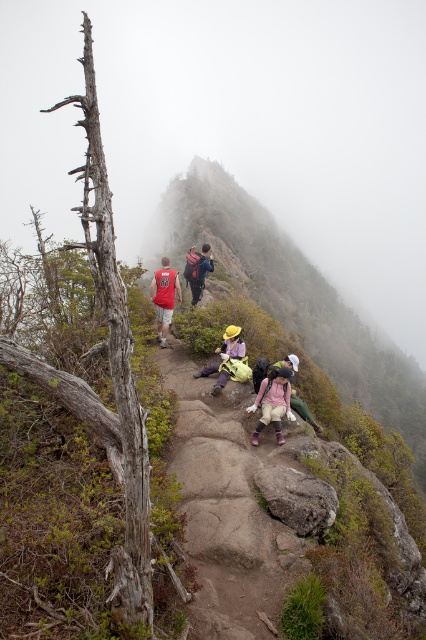
Question: Which object is closer to the camera taking this photo?

Choices:
 (A) yellow fabric hat at center
 (B) matte red backpack at center
 (C) rough stone trail at center
 (D) khaki pants at center

Answer: (C)

Question: Among these objects, which one is nearest to the camera?

Choices:
 (A) matte red backpack at center
 (B) matte red t-shirt at center
 (C) khaki pants at center

Answer: (C)

Question: Which of these objects is positioned closest to the rough stone trail at center?

Choices:
 (A) khaki pants at center
 (B) matte red backpack at center
 (C) matte red t-shirt at center
 (D) yellow fabric hat at center

Answer: (A)

Question: Is rough stone trail at center bigger than matte red t-shirt at center?

Choices:
 (A) no
 (B) yes

Answer: (A)

Question: Can you confirm if rough stone trail at center is positioned below khaki pants at center?

Choices:
 (A) no
 (B) yes

Answer: (B)

Question: Can you confirm if khaki pants at center is positioned above yellow fabric hat at center?

Choices:
 (A) yes
 (B) no

Answer: (B)